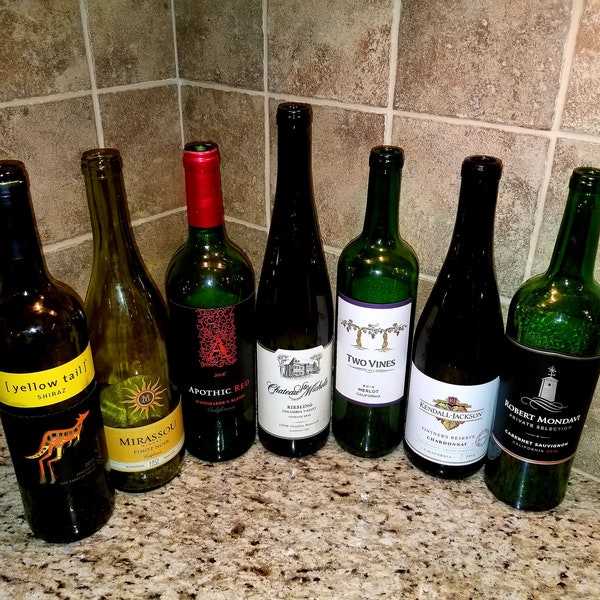
This screenshot has width=600, height=600. Identify the location of tile. (498, 77).